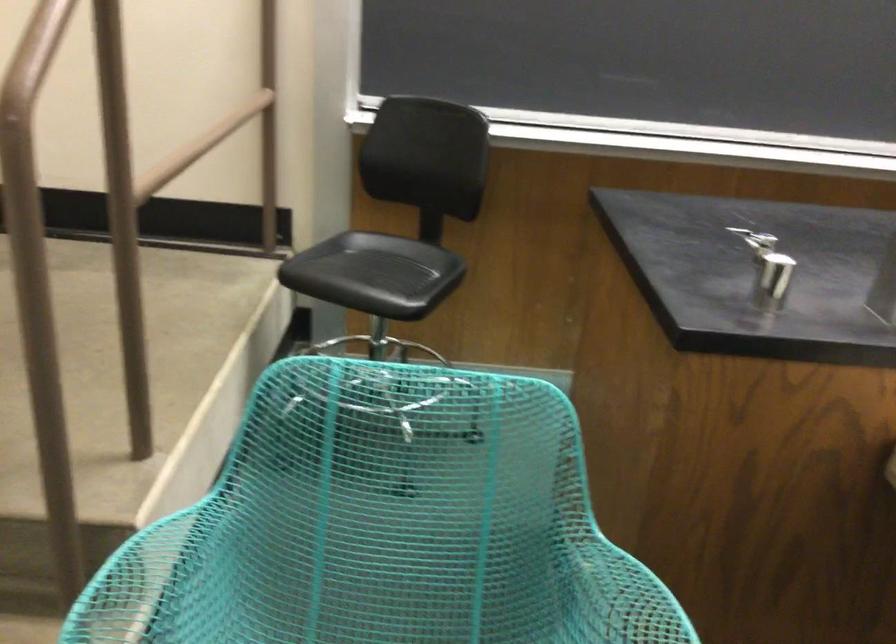
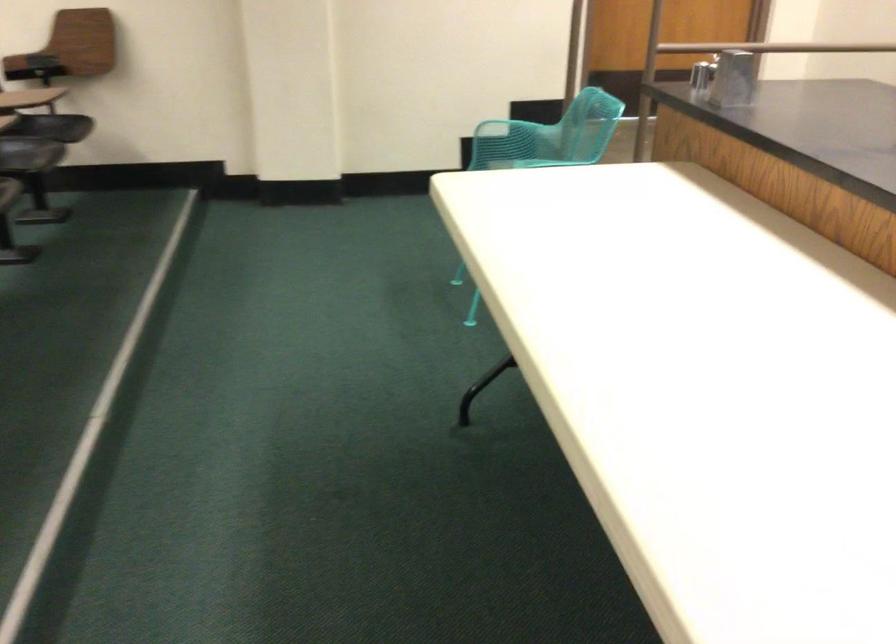
Question: I am providing you with two images of the same scene from different viewpoints. Which of the following objects are not visible in image2?

Choices:
 (A) turquoise chair sitting surface
 (B) orange pumpkin object
 (C) metal shaker
 (D) chair sitting surface

Answer: (A)